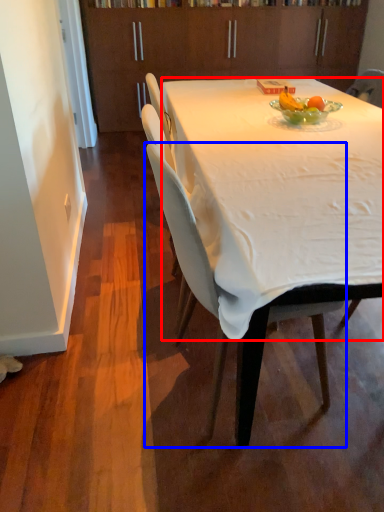
Question: Which point is closer to the camera, desk (highlighted by a red box) or chair (highlighted by a blue box)?

Choices:
 (A) desk
 (B) chair

Answer: (A)